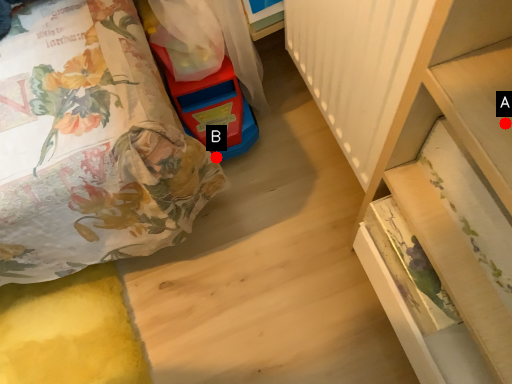
Question: Two points are circled on the image, labeled by A and B beside each circle. Which point is farther to the camera?

Choices:
 (A) A is further
 (B) B is further

Answer: (B)